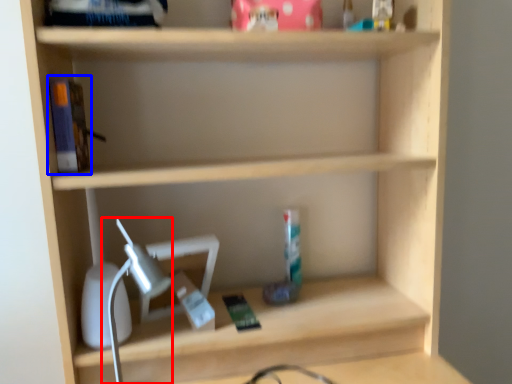
Question: Among these objects, which one is nearest to the camera, table lamp (highlighted by a red box) or book (highlighted by a blue box)?

Choices:
 (A) table lamp
 (B) book

Answer: (A)